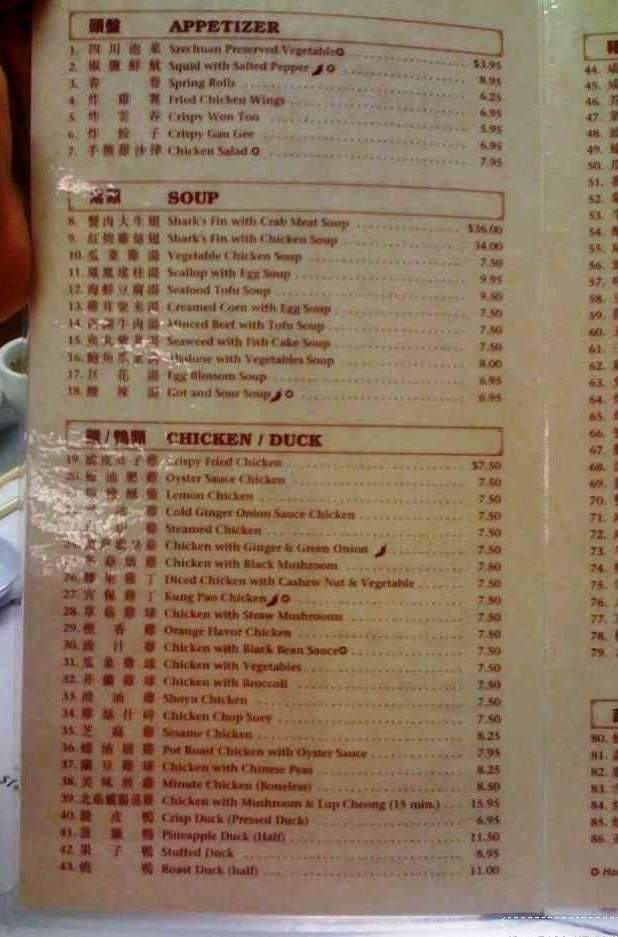
Locate an element on the screen. tabletop is located at coordinates (9, 700).